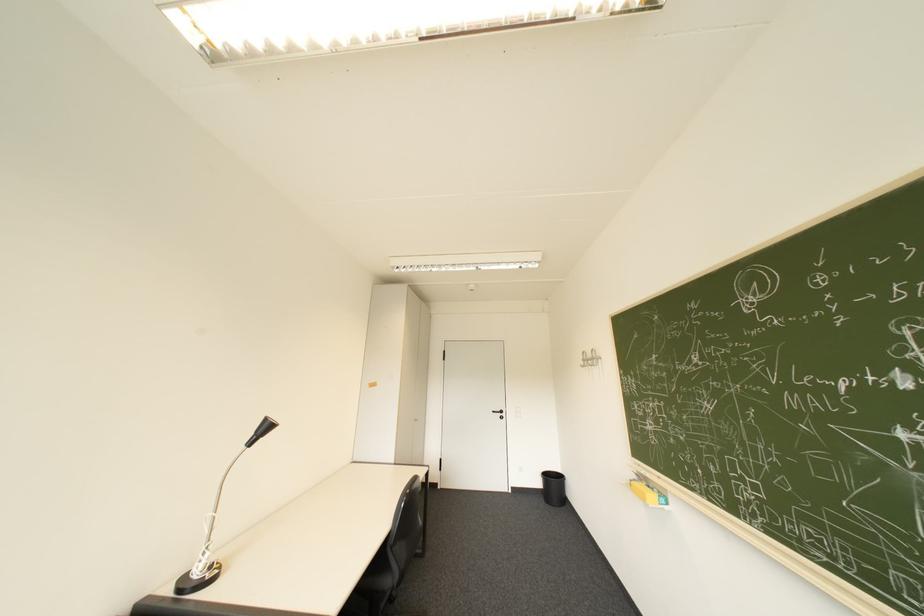
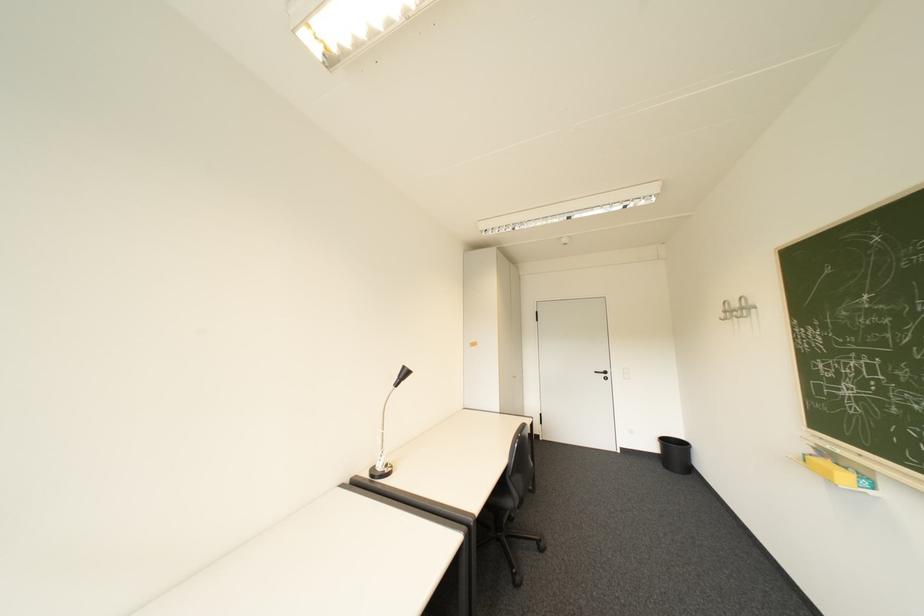
Question: The camera is either moving clockwise (left) or counter-clockwise (right) around the object. The first image is from the beginning of the video and the second image is from the end. Is the camera moving left or right when shooting the video?

Choices:
 (A) Left
 (B) Right

Answer: (B)